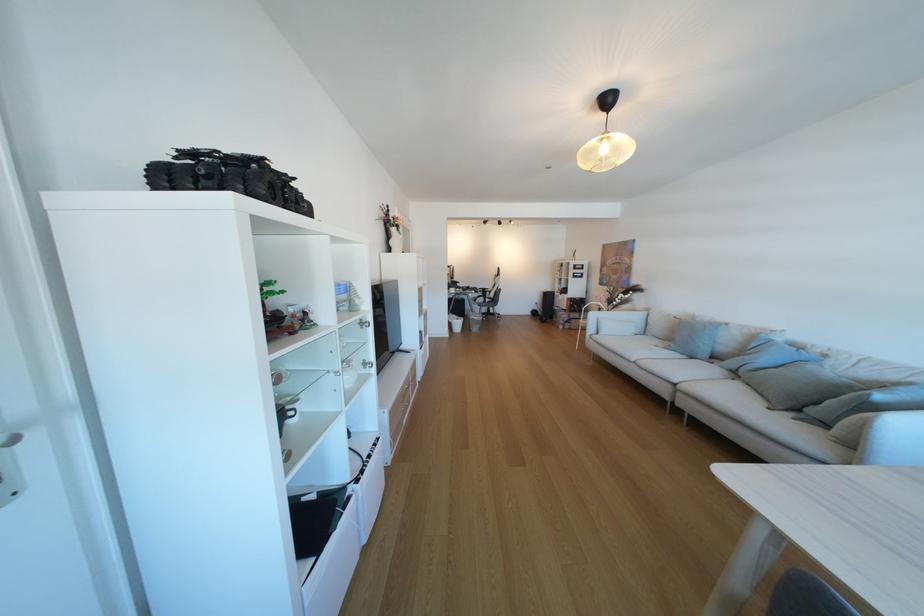
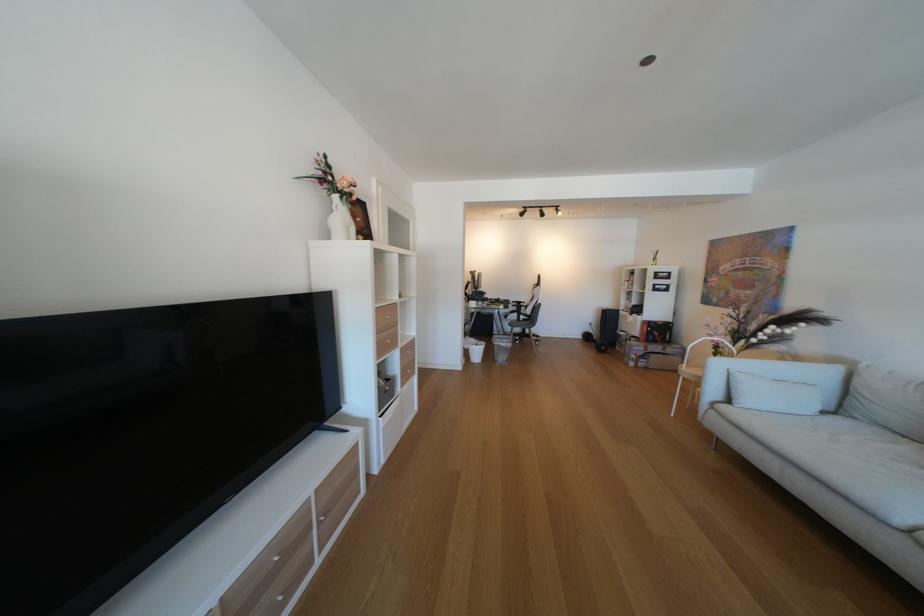
In the second image, find the point that corresponds to pixel 394 211 in the first image.

(331, 166)